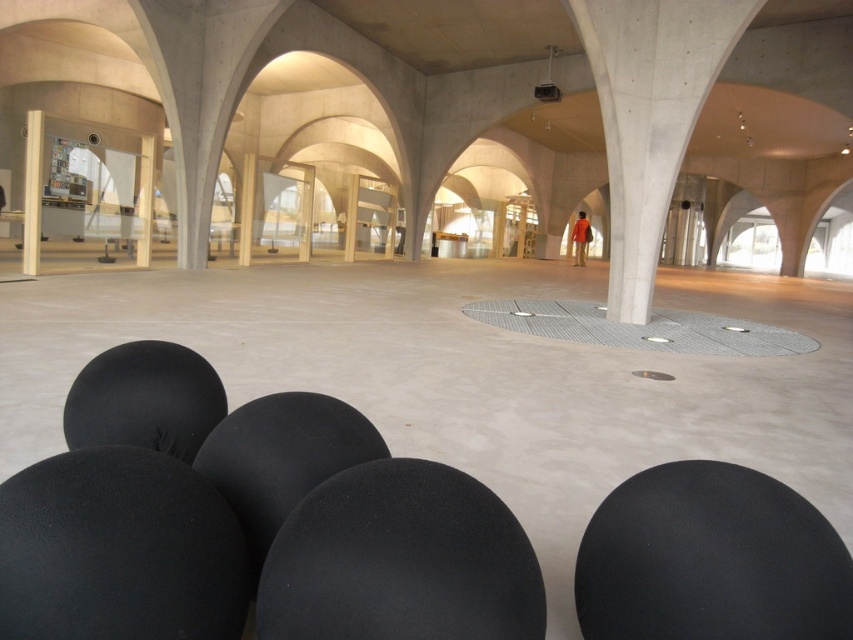
In the scene shown: Does matte white pillar at center have a smaller size compared to matte gray pillar at center?

No.

Can you confirm if matte white pillar at center is wider than matte gray pillar at center?

Yes.

Locate an element on the screen. Image resolution: width=853 pixels, height=640 pixels. matte white pillar at center is located at coordinates (144, 200).

Between matte concrete pillar at center and matte gray pillar at center, which one has less height?

With less height is matte gray pillar at center.

Does point (250, 220) come in front of point (350, 179)?

Yes.

Image resolution: width=853 pixels, height=640 pixels. Identify the location of matte concrete pillar at center. (247, 209).

Is matte white pillar at center thinner than matte concrete pillar at center?

Indeed, matte white pillar at center has a lesser width compared to matte concrete pillar at center.

Where is `matte white pillar at center`? Image resolution: width=853 pixels, height=640 pixels. matte white pillar at center is located at coordinates (144, 200).